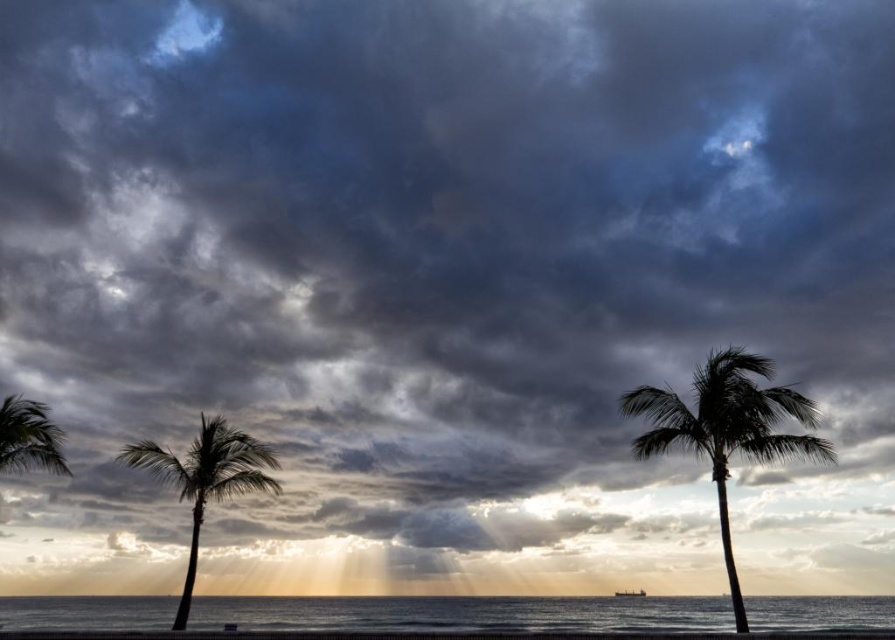
You are a photographer standing on the beach and want to capture the reflection of the sunset in the clear water at lower center. Based on the coordinates provided, where should you position yourself to ensure the reflection is fully visible in your shot?

You should position yourself at point (461,614) to capture the reflection of the sunset in the clear water at lower center as specified.

You are standing on the beach looking at the scene. Which object is closer to your right side, the clear water at lower center or the silky brown palm tree at left?

The clear water at lower center is to the right of the silky brown palm tree at left, so the clear water at lower center is closer to your right side.

You are a photographer trying to capture the silhouette palm tree at right in your shot. You want to ensure that the clear water at lower center is visible in the reflection of the tree. Based on the scene description, can you confirm if this is possible?

The clear water at lower center is located below the silhouette palm tree at right, so yes, the silhouette palm tree at right can be reflected in the clear water at lower center.